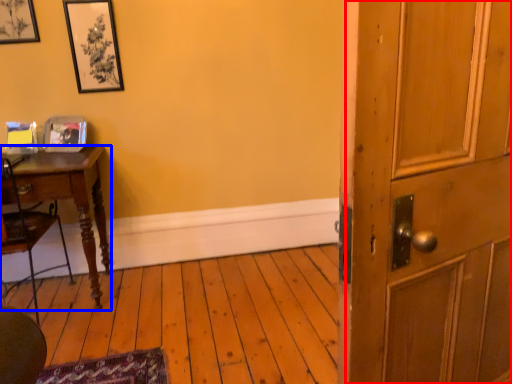
Question: Which point is closer to the camera, barn door (highlighted by a red box) or desk (highlighted by a blue box)?

Choices:
 (A) barn door
 (B) desk

Answer: (A)